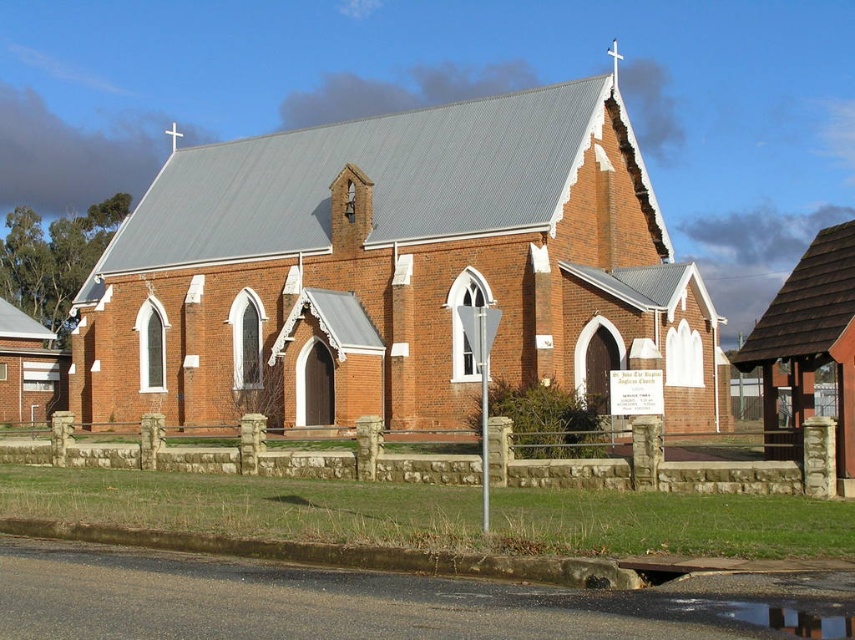
You are a photographer planning to take a wide shot of the red brick church at center and the glossy concrete puddle at lower center. Which object will appear wider in the photo?

The red brick church at center will appear wider in the photo since its width surpasses that of the glossy concrete puddle at lower center.

You are standing in front of the red brick church at center and notice the glossy concrete puddle at lower center nearby. Which object is taller?

The red brick church at center is taller than the glossy concrete puddle at lower center.